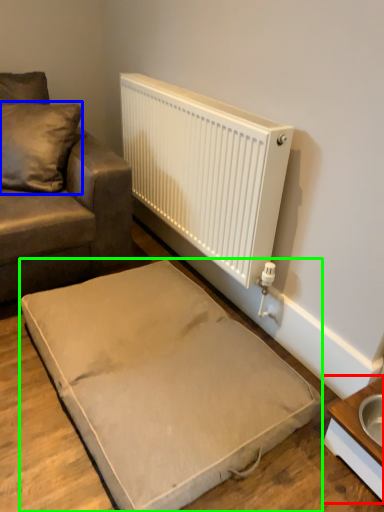
Question: Which is nearer to the table (highlighted by a red box)? pillow (highlighted by a blue box) or furniture (highlighted by a green box).

Choices:
 (A) pillow
 (B) furniture

Answer: (B)